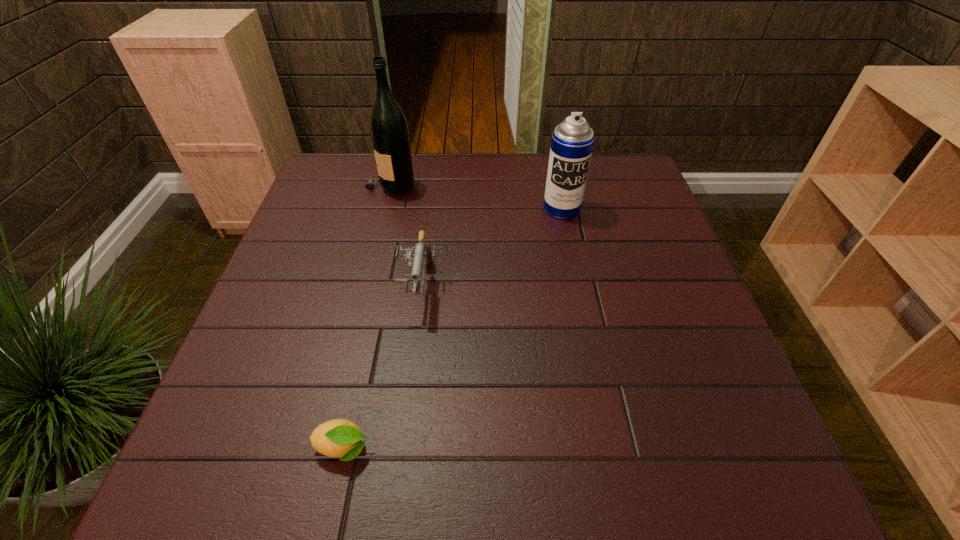
Identify the location of the second closest object to the gun. (341, 438).

Choose which object is the third nearest neighbor to the lemon. Please provide its 2D coordinates. Your answer should be formatted as a tuple, i.e. [(x, y)], where the tuple contains the x and y coordinates of a point satisfying the conditions above.

[(389, 131)]

Find the location of a particular element. The height and width of the screenshot is (540, 960). free space that satisfies the following two spatial constraints: 1. at the barrel end of the third tallest object; 2. with leaves positioned above the nearest object is located at coordinates (396, 449).

Find the location of a particular element. free space in the image that satisfies the following two spatial constraints: 1. at the barrel end of the third farthest object; 2. with leaves positioned above the lemon is located at coordinates (396, 449).

Locate an element on the screen. This screenshot has width=960, height=540. free point that satisfies the following two spatial constraints: 1. on the label side of the third shortest object; 2. with leaves positioned above the nearest object is located at coordinates (612, 449).

Locate an element on the screen. The width and height of the screenshot is (960, 540). blank area in the image that satisfies the following two spatial constraints: 1. on the label side of the rightmost object; 2. with leaves positioned above the shortest object is located at coordinates (612, 449).